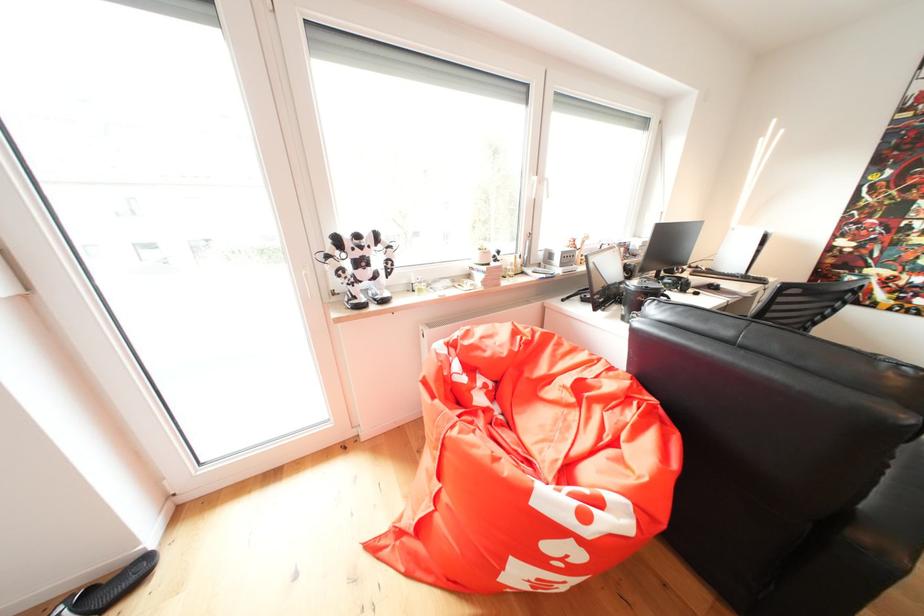
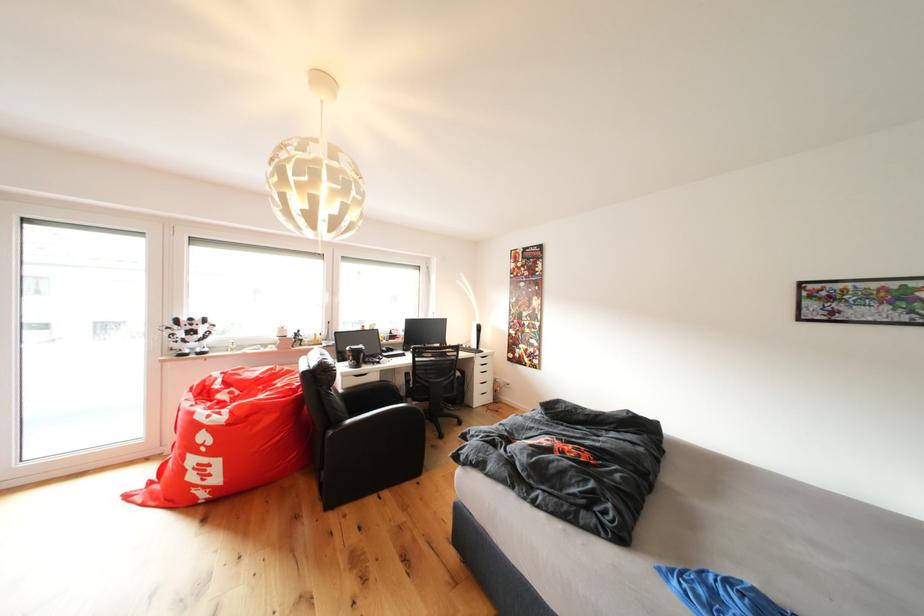
The point at [367,241] is marked in the first image. Where is the corresponding point in the second image?

(200, 323)